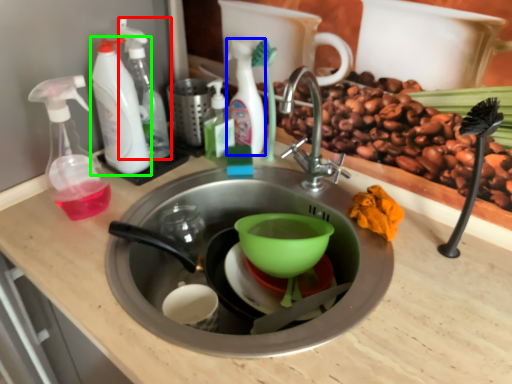
Question: Based on their relative distances, which object is nearer to cleaning product (highlighted by a red box)? Choose from cleaning product (highlighted by a blue box) and cleaning product (highlighted by a green box).

Choices:
 (A) cleaning product
 (B) cleaning product

Answer: (B)